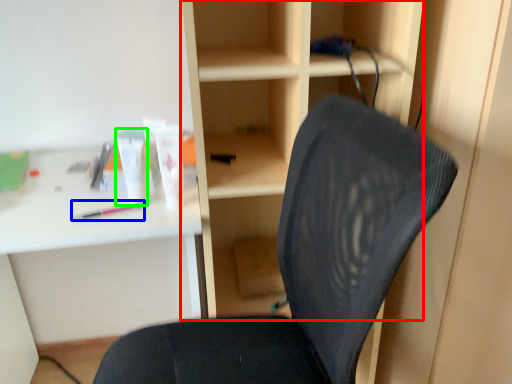
Question: Estimate the real-world distances between objects in this image. Which object is closer to bookshelf (highlighted by a red box), stationery (highlighted by a blue box) or toiletry (highlighted by a green box)?

Choices:
 (A) stationery
 (B) toiletry

Answer: (B)